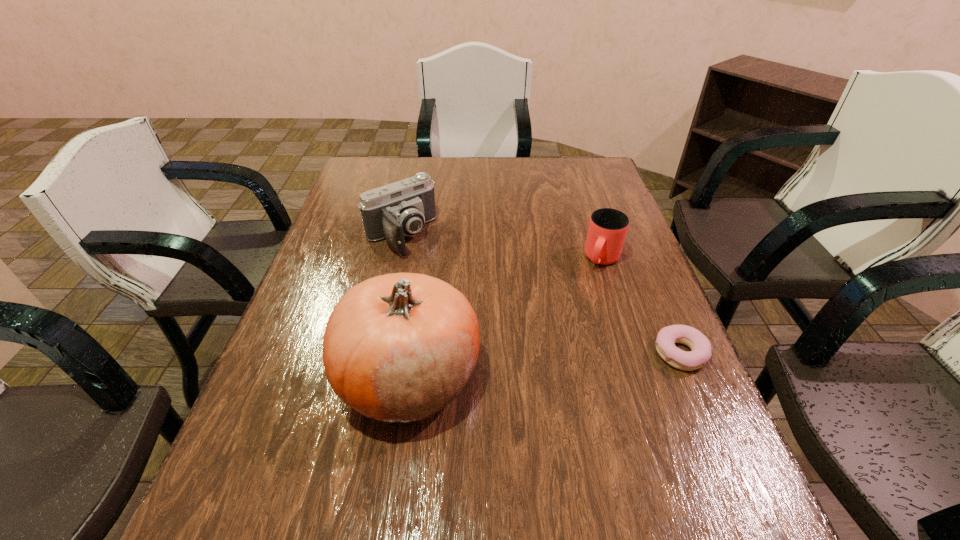
Locate an element on the screen. The height and width of the screenshot is (540, 960). pumpkin is located at coordinates (397, 348).

Where is `the shortest object`? the shortest object is located at coordinates (700, 346).

Find the location of a particular element. The image size is (960, 540). the third shortest object is located at coordinates (401, 208).

Identify the location of the third tallest object. (607, 230).

At what (x,y) coordinates should I click in order to perform the action: click on free space located 0.260m on the back of the tallest object. Please return your answer as a coordinate pair (x, y). This screenshot has height=540, width=960. Looking at the image, I should click on (427, 255).

The height and width of the screenshot is (540, 960). Find the location of `vacant region located on the left of the doughnut`. vacant region located on the left of the doughnut is located at coordinates (493, 353).

The width and height of the screenshot is (960, 540). In order to click on vacant space positioned at the front of the camera with an open lens cover in this screenshot , I will do point(492,339).

At what (x,y) coordinates should I click in order to perform the action: click on vacant space situated at the front of the camera with an open lens cover. Please return your answer as a coordinate pair (x, y). This screenshot has height=540, width=960. Looking at the image, I should click on (492, 339).

I want to click on free region located at the front of the camera with an open lens cover, so click(x=437, y=278).

Locate an element on the screen. The width and height of the screenshot is (960, 540). free space located on the handle side of the second shortest object is located at coordinates (587, 297).